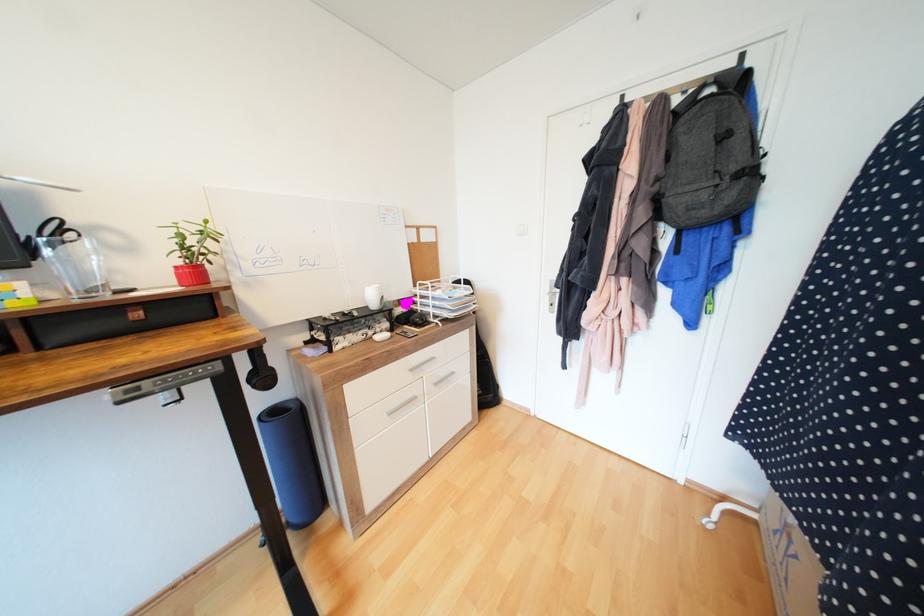
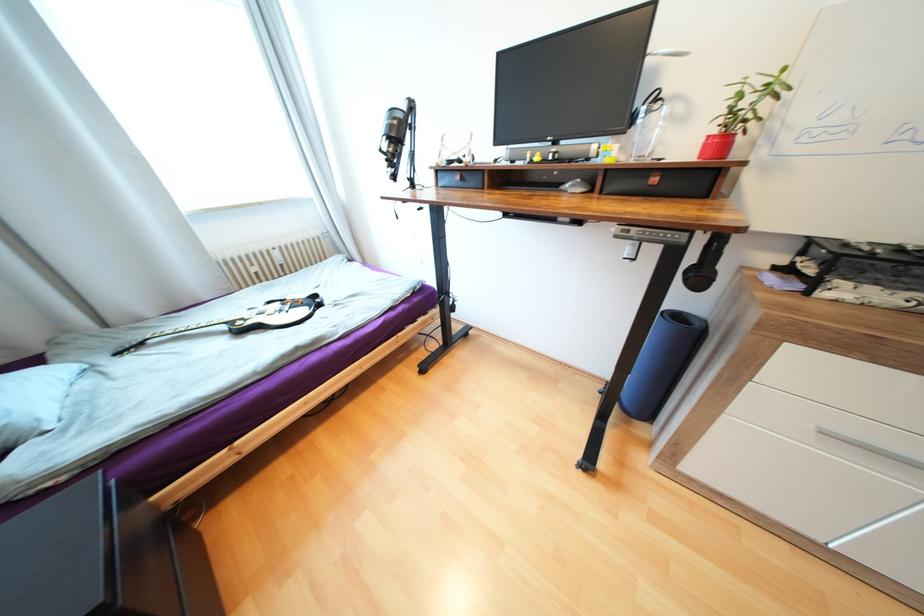
Where in the second image is the point corresponding to the point at 183,268 from the first image?

(714, 138)